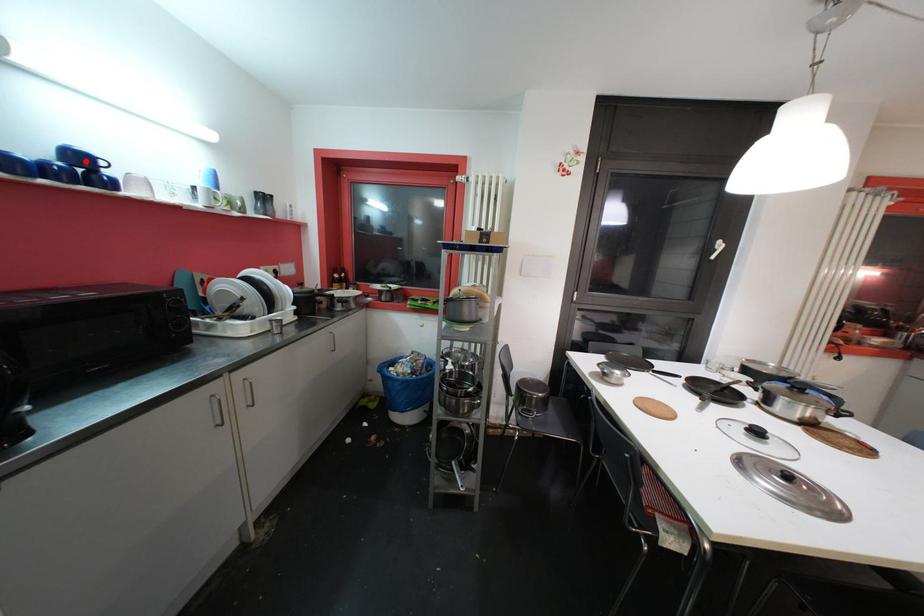
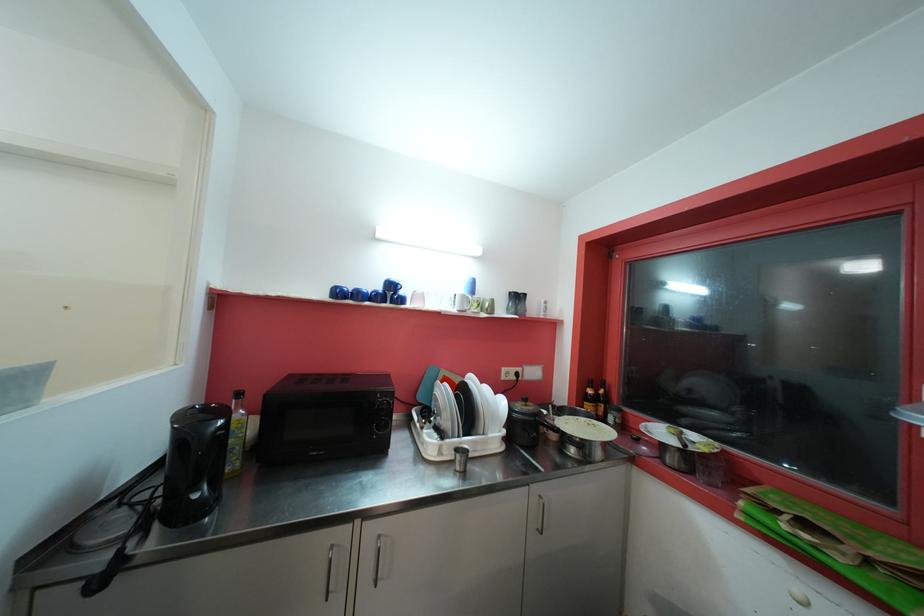
Find the pixel in the second image that matches the highlighted location in the first image.

(396, 288)